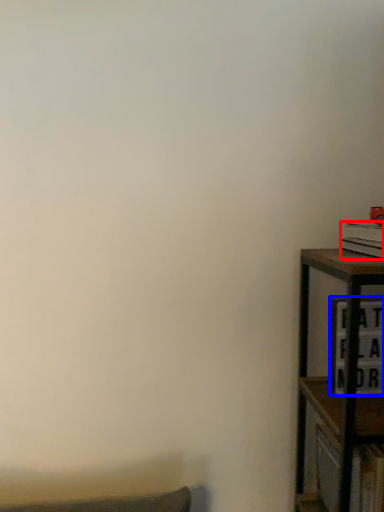
Question: Which object appears closest to the camera in this image, book (highlighted by a red box) or cabinet (highlighted by a blue box)?

Choices:
 (A) book
 (B) cabinet

Answer: (A)